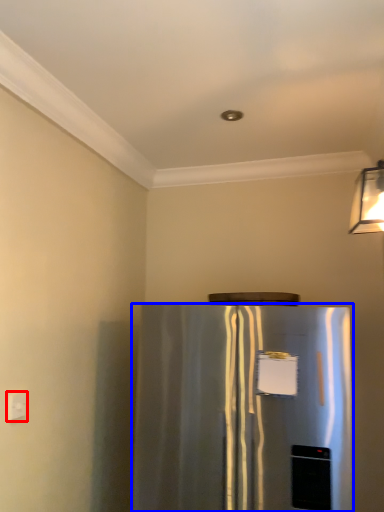
Question: Which object is further to the camera taking this photo, electric outlet (highlighted by a red box) or refrigerator (highlighted by a blue box)?

Choices:
 (A) electric outlet
 (B) refrigerator

Answer: (A)